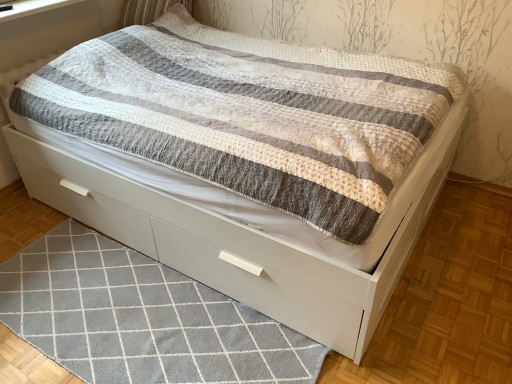
The height and width of the screenshot is (384, 512). I want to click on free space below gray textured rug at lower center (from a real-world perspective), so click(154, 332).